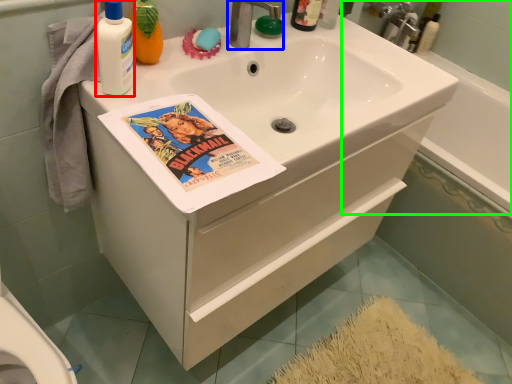
Question: Considering the real-world distances, which object is closest to cleaning product (highlighted by a red box)? tap (highlighted by a blue box) or bath (highlighted by a green box).

Choices:
 (A) tap
 (B) bath

Answer: (A)